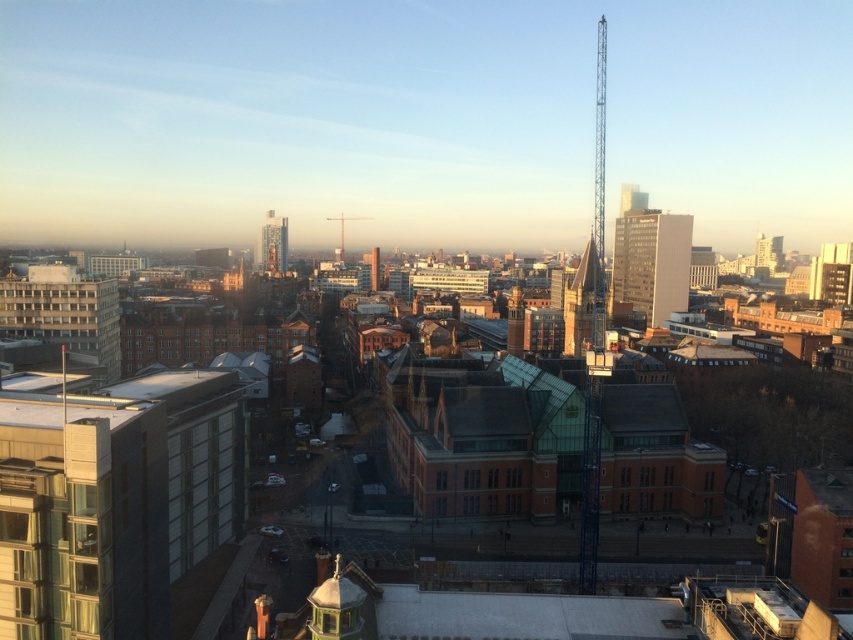
Question: Can you confirm if brick tower at center is positioned to the left of brick spire at center?

Choices:
 (A) no
 (B) yes

Answer: (A)

Question: Observing the image, what is the correct spatial positioning of matte glass skyscraper at upper right in reference to brick spire at center?

Choices:
 (A) above
 (B) below

Answer: (B)

Question: Among these points, which one is nearest to the camera?

Choices:
 (A) (343, 244)
 (B) (634, 292)
 (C) (569, 288)
 (D) (280, 248)

Answer: (C)

Question: Estimate the real-world distances between objects in this image. Which object is farther from the brick spire at center?

Choices:
 (A) matte glass skyscraper at upper right
 (B) glassy teal skyscraper at center-left
 (C) brick tower at center

Answer: (C)

Question: Which object is closer to the camera taking this photo?

Choices:
 (A) glassy teal skyscraper at center-left
 (B) brick spire at center

Answer: (A)

Question: Does matte glass skyscraper at upper right have a lesser width compared to brick spire at center?

Choices:
 (A) yes
 (B) no

Answer: (A)